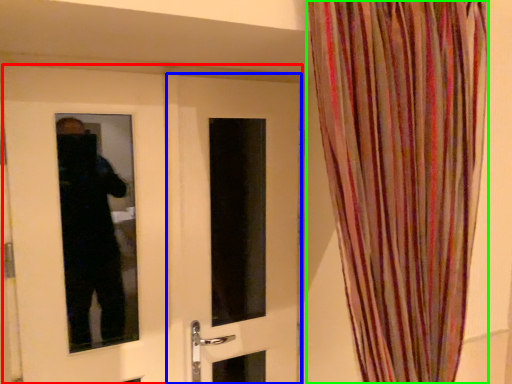
Question: Which object is the farthest from door (highlighted by a red box)? Choose among these: door (highlighted by a blue box) or curtain (highlighted by a green box).

Choices:
 (A) door
 (B) curtain

Answer: (B)